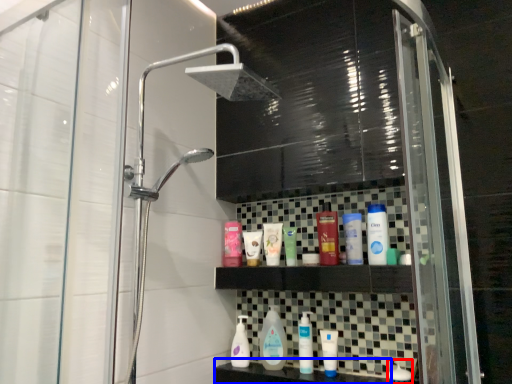
Question: Which of the following is the farthest to the observer, toiletry (highlighted by a red box) or counter top (highlighted by a blue box)?

Choices:
 (A) toiletry
 (B) counter top

Answer: (A)